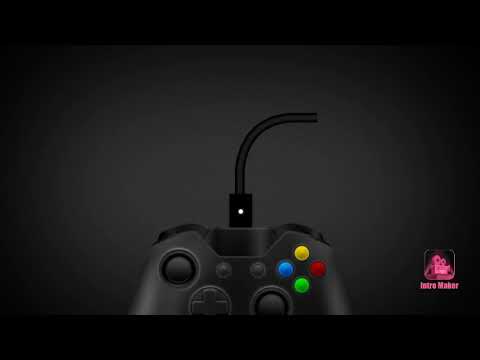
The image size is (480, 360). I want to click on cable connecter, so click(243, 208).